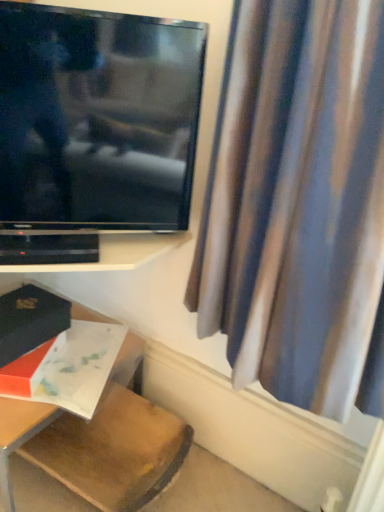
Question: Is wooden table at lower left inside or outside of matte white book at lower left, which ranks as the 1th book in bottom-to-top order?

Choices:
 (A) inside
 (B) outside

Answer: (B)

Question: Is wooden table at lower left in front of or behind matte white book at lower left, which is counted as the 2th book, starting from the top, in the image?

Choices:
 (A) front
 (B) behind

Answer: (A)

Question: Estimate the real-world distances between objects in this image. Which object is farther from the matte black book at lower left, which is counted as the first book, starting from the top?

Choices:
 (A) black plastic shelf at lower left
 (B) silky blue curtain at right
 (C) matte white book at lower left, which is counted as the 2th book, starting from the top
 (D) wooden table at lower left
 (E) flat screen tv at upper left

Answer: (B)

Question: Based on their relative distances, which object is farther from the wooden table at lower left?

Choices:
 (A) flat screen tv at upper left
 (B) matte white book at lower left, which is counted as the 2th book, starting from the top
 (C) black plastic shelf at lower left
 (D) silky blue curtain at right
 (E) matte black book at lower left, which is counted as the first book, starting from the top

Answer: (D)